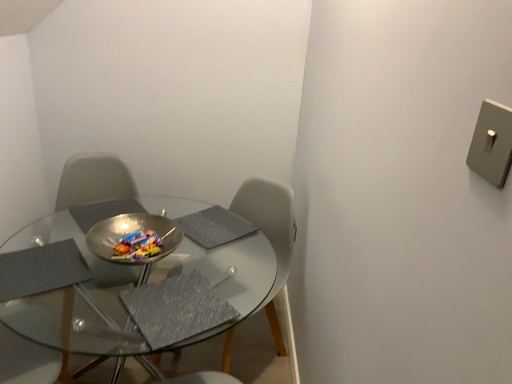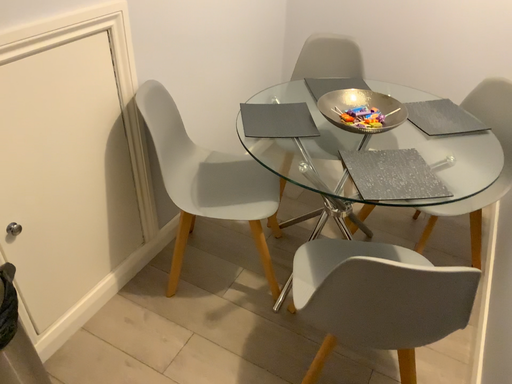
Question: How did the camera likely rotate when shooting the video?

Choices:
 (A) rotated downward
 (B) rotated upward

Answer: (A)